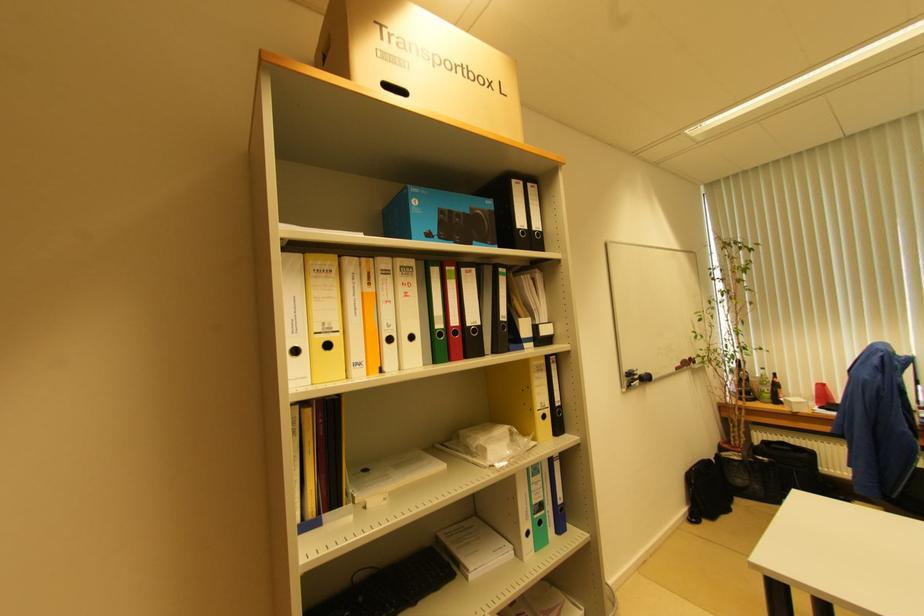
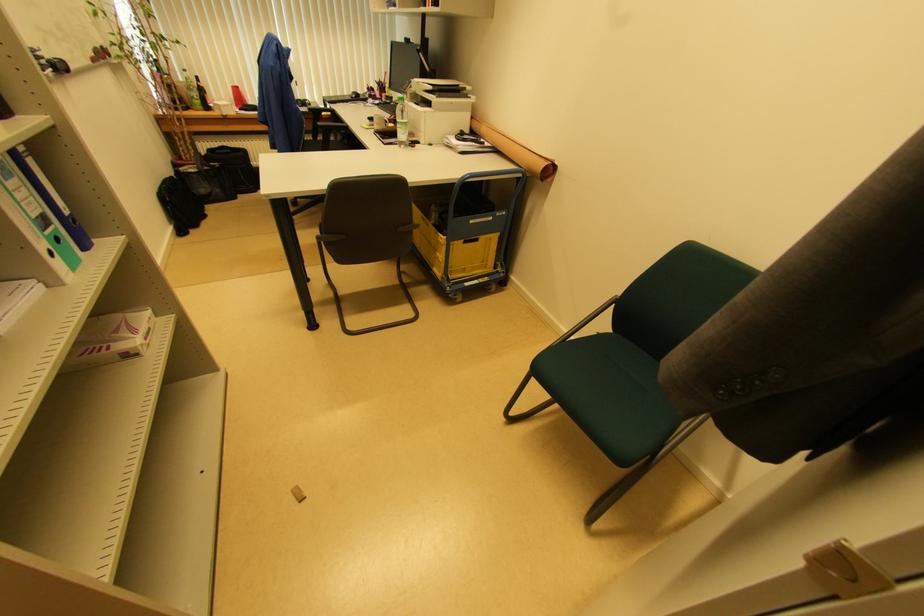
Where in the second image is the point corresponding to [772,392] from the first image?

(200, 98)